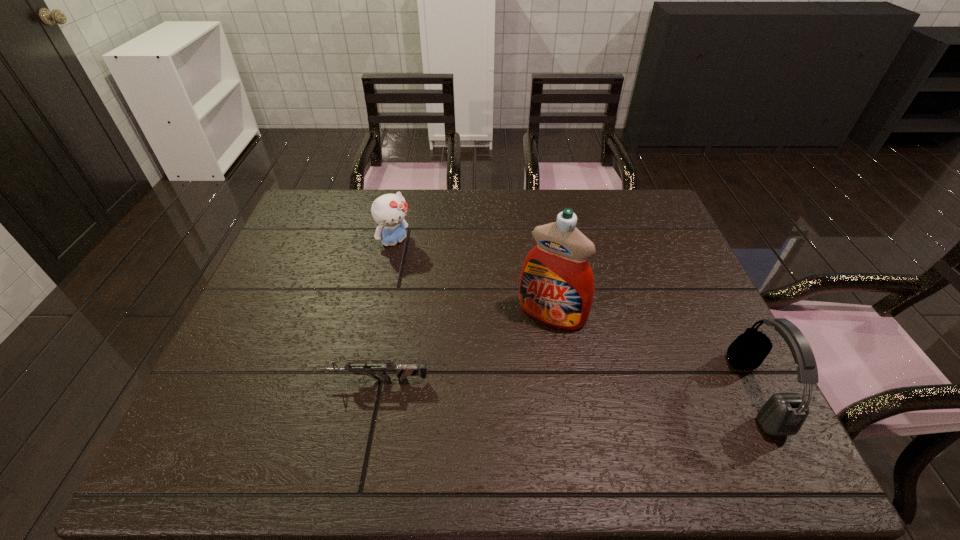
I want to click on gun, so coord(402,371).

Where is `the third shortest object`? the third shortest object is located at coordinates (783, 414).

Identify the location of headset. (783, 414).

Locate an element on the screen. The height and width of the screenshot is (540, 960). kitten is located at coordinates (389, 211).

This screenshot has width=960, height=540. I want to click on the farthest object, so (x=389, y=211).

The image size is (960, 540). Identify the location of the third object from left to right. (556, 286).

Image resolution: width=960 pixels, height=540 pixels. In order to click on detergent in this screenshot , I will do `click(556, 286)`.

Identify the location of free space located aimed along the barrel of the shortest object. The width and height of the screenshot is (960, 540). [x=290, y=380].

Find the location of a particular element. The width and height of the screenshot is (960, 540). free spot located aimed along the barrel of the shortest object is located at coordinates (273, 380).

This screenshot has height=540, width=960. Find the location of `vacant area situated 0.050m aimed along the barrel of the shortest object`. vacant area situated 0.050m aimed along the barrel of the shortest object is located at coordinates (302, 380).